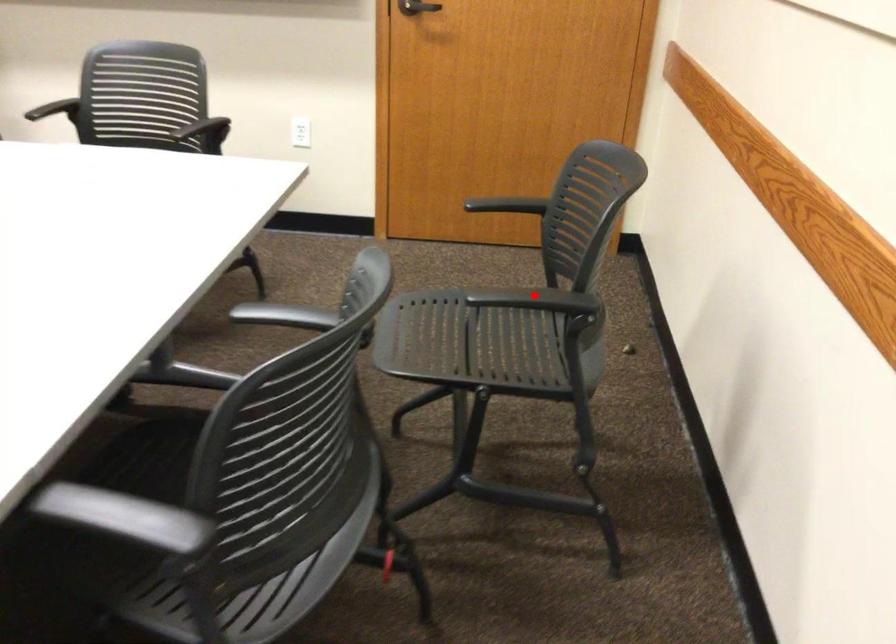
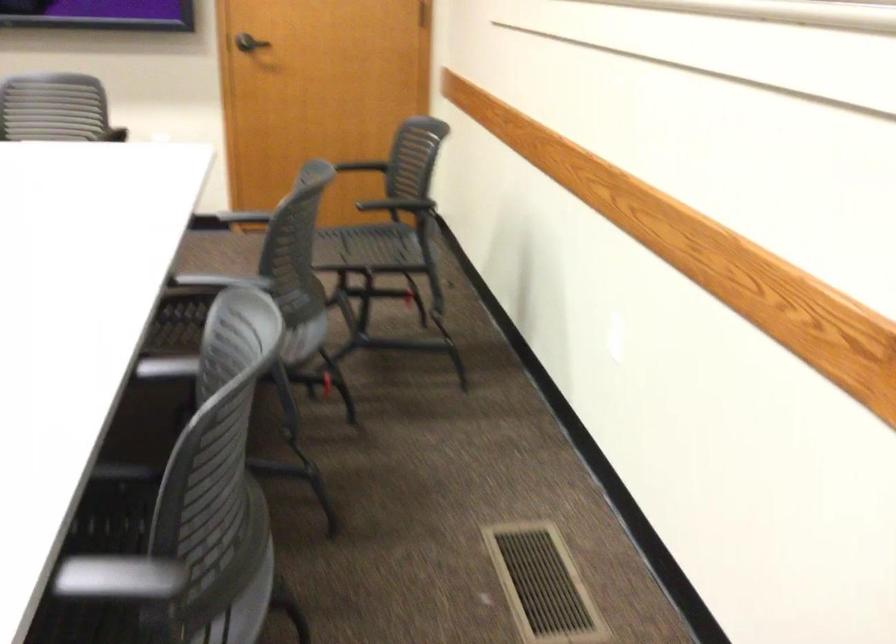
In the second image, find the point that corresponds to the highlighted location in the first image.

(398, 205)